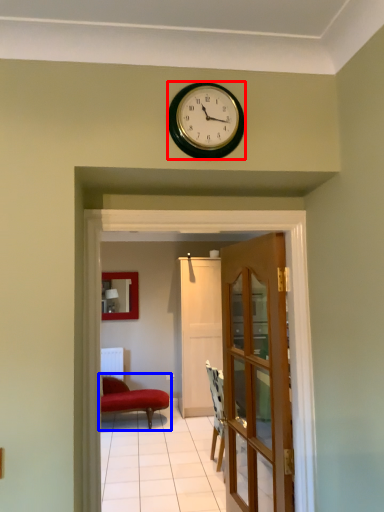
Question: Which of the following is the farthest to the observer, wall clock (highlighted by a red box) or studio couch (highlighted by a blue box)?

Choices:
 (A) wall clock
 (B) studio couch

Answer: (B)